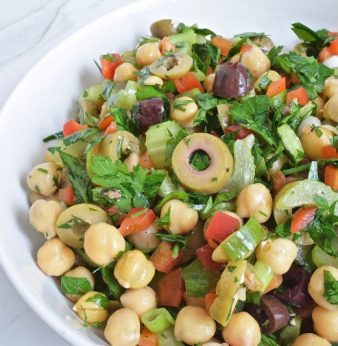
Where is `plate`? Image resolution: width=338 pixels, height=346 pixels. plate is located at coordinates (46, 105).